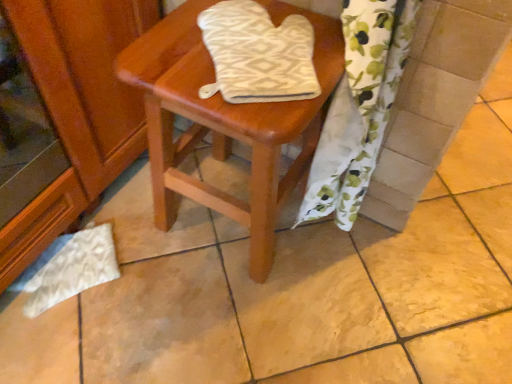
Question: In terms of width, does white textured oven mitt at center look wider or thinner when compared to wooden stool at center?

Choices:
 (A) thin
 (B) wide

Answer: (A)

Question: Considering the relative positions of white textured oven mitt at center and wooden stool at center in the image provided, is white textured oven mitt at center to the left or to the right of wooden stool at center?

Choices:
 (A) right
 (B) left

Answer: (A)

Question: Which object is positioned farthest from the white floral fabric at lower right?

Choices:
 (A) wooden stool at center
 (B) white textured oven mitt at center

Answer: (B)

Question: Which is nearer to the wooden stool at center?

Choices:
 (A) white textured oven mitt at center
 (B) white floral fabric at lower right

Answer: (A)